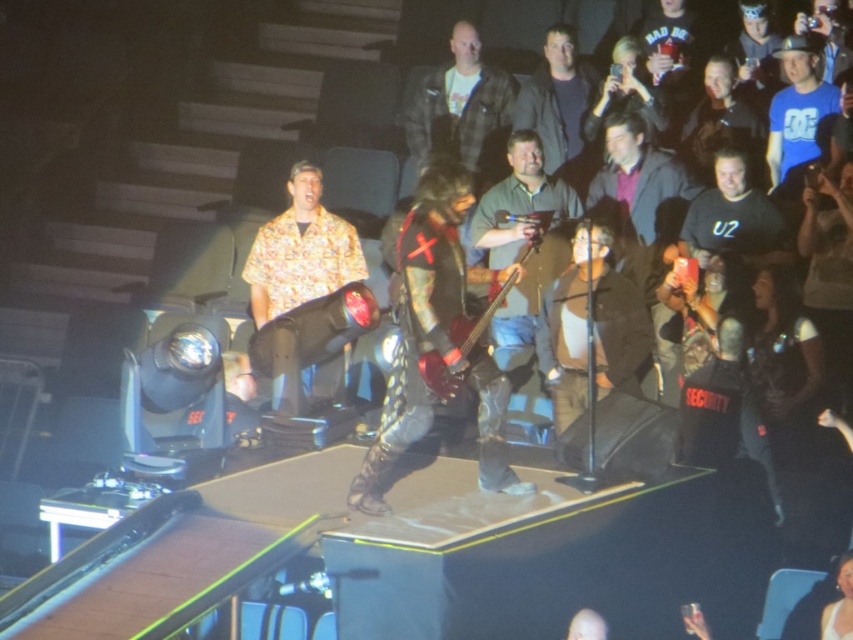
Does brown leather jacket at center appear under dark blue shirt at upper center?

Yes.

Between brown leather jacket at center and dark blue shirt at upper center, which one appears on the right side from the viewer's perspective?

brown leather jacket at center

Between point (612, 378) and point (556, 109), which one is positioned behind?

The point (556, 109) is behind.

Locate an element on the screen. This screenshot has width=853, height=640. brown leather jacket at center is located at coordinates (590, 326).

Image resolution: width=853 pixels, height=640 pixels. What do you see at coordinates (462, 109) in the screenshot?
I see `leather jacket at upper center` at bounding box center [462, 109].

Is leather jacket at upper center below dark blue shirt at upper center?

No.

What are the coordinates of `leather jacket at upper center` in the screenshot? It's located at (462, 109).

Is leather jacket at center below leather jacket at upper center?

Yes.

Find the location of `leather jacket at center`. leather jacket at center is located at coordinates (436, 340).